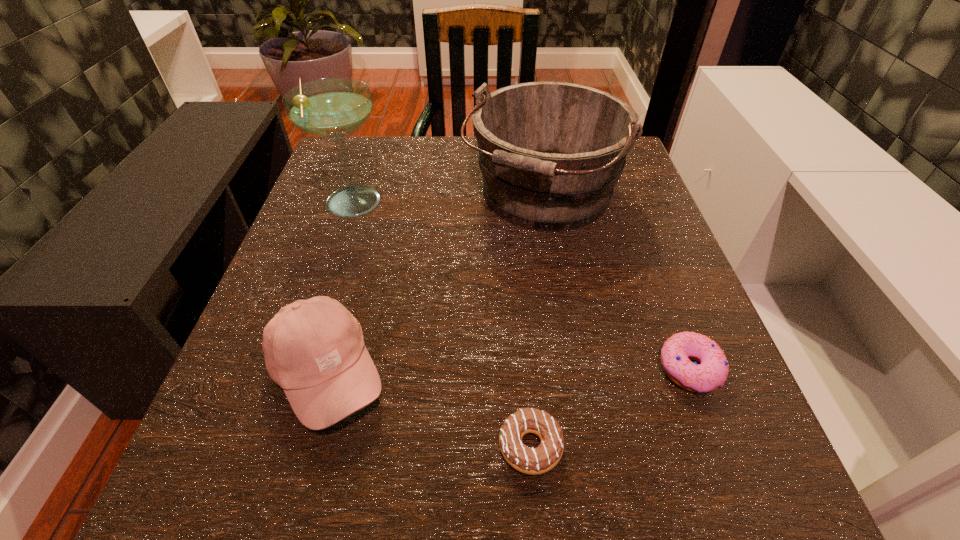
The image size is (960, 540). In order to click on the tallest object in this screenshot , I will do `click(332, 108)`.

Where is `the fourth shortest object`? the fourth shortest object is located at coordinates (550, 153).

Locate an element on the screen. The image size is (960, 540). baseball cap is located at coordinates (314, 349).

Locate an element on the screen. Image resolution: width=960 pixels, height=540 pixels. the second shortest object is located at coordinates (711, 373).

This screenshot has height=540, width=960. Identify the location of the farther doughnut. (711, 373).

Image resolution: width=960 pixels, height=540 pixels. Find the location of `the nearer doughnut`. the nearer doughnut is located at coordinates (533, 461).

At what (x,y) coordinates should I click in order to perform the action: click on the shorter doughnut. Please return your answer as a coordinate pair (x, y). The height and width of the screenshot is (540, 960). Looking at the image, I should click on (533, 461).

Identify the location of vacant region located on the back of the tallest object. The width and height of the screenshot is (960, 540). (371, 150).

Identify the location of free space located 0.310m on the front of the wine bucket. Image resolution: width=960 pixels, height=540 pixels. (576, 405).

The image size is (960, 540). Identify the location of vacant space located 0.290m on the front-facing side of the third shortest object. (591, 373).